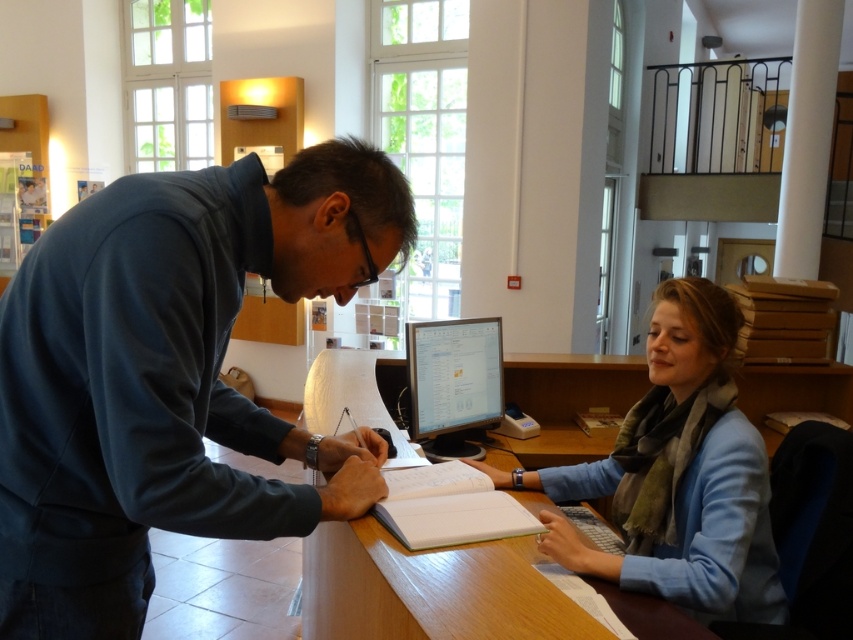
Can you confirm if dark blue fleece at left is positioned above wooden table at center?

Yes, dark blue fleece at left is above wooden table at center.

Is dark blue fleece at left bigger than wooden table at center?

Incorrect, dark blue fleece at left is not larger than wooden table at center.

Identify the location of dark blue fleece at left. (170, 376).

Looking at this image, between dark blue fleece at left and white paper notebook at center, which one is positioned lower?

white paper notebook at center

Can you confirm if dark blue fleece at left is thinner than white paper notebook at center?

In fact, dark blue fleece at left might be wider than white paper notebook at center.

Is point (357, 212) positioned behind point (376, 515)?

No, it is in front of (376, 515).

Find the location of a particular element. dark blue fleece at left is located at coordinates (170, 376).

Does point (245, 518) lie in front of point (679, 506)?

Yes, it is in front of point (679, 506).

Based on the photo, does dark blue fleece at left have a greater width compared to blue fabric scarf at center?

No.

Which is in front, point (4, 500) or point (683, 490)?

Point (4, 500)

Identify the location of dark blue fleece at left. This screenshot has width=853, height=640. (170, 376).